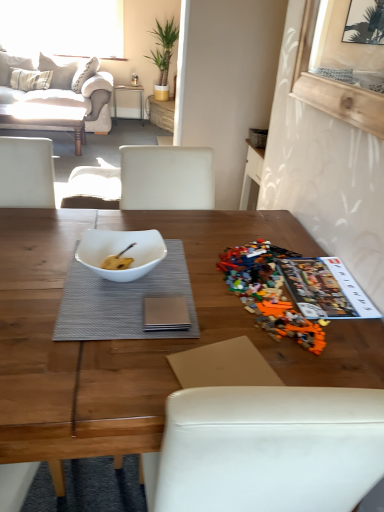
Locate an element on the screen. This screenshot has width=384, height=512. vacant space positioned to the left of white paper magazine at right is located at coordinates (283, 305).